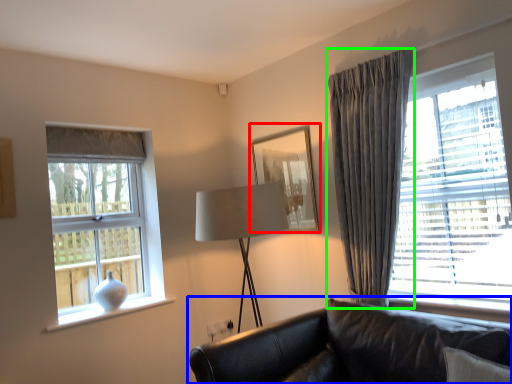
Question: Considering the real-world distances, which object is closest to picture frame (highlighted by a red box)? studio couch (highlighted by a blue box) or curtain (highlighted by a green box).

Choices:
 (A) studio couch
 (B) curtain

Answer: (B)